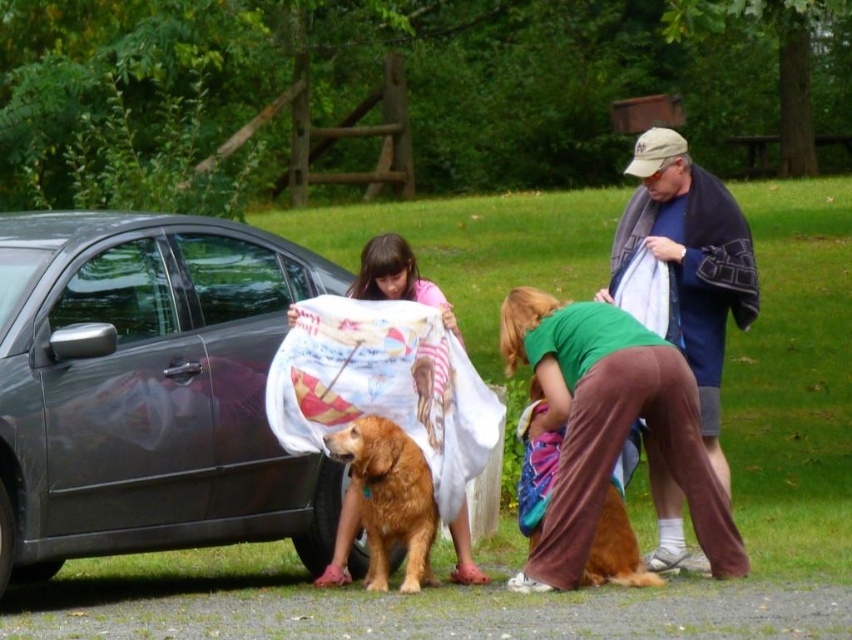
Question: Is blue knit sweater at center closer to the viewer compared to golden fur dog at lower center?

Choices:
 (A) no
 (B) yes

Answer: (A)

Question: Can you confirm if blue knit sweater at center is smaller than brown furry dog at lower center?

Choices:
 (A) yes
 (B) no

Answer: (B)

Question: Which point appears farthest from the camera in this image?

Choices:
 (A) (364, 496)
 (B) (533, 524)
 (C) (755, 294)

Answer: (C)

Question: Is the position of shiny black car at left less distant than that of matte pink shirt at center?

Choices:
 (A) yes
 (B) no

Answer: (A)

Question: Which object appears farthest from the camera in this image?

Choices:
 (A) golden fur dog at lower center
 (B) matte pink shirt at center

Answer: (B)

Question: Which is nearer to the green fabric at lower center?

Choices:
 (A) golden fur dog at lower center
 (B) matte pink shirt at center
 (C) shiny black car at left

Answer: (A)